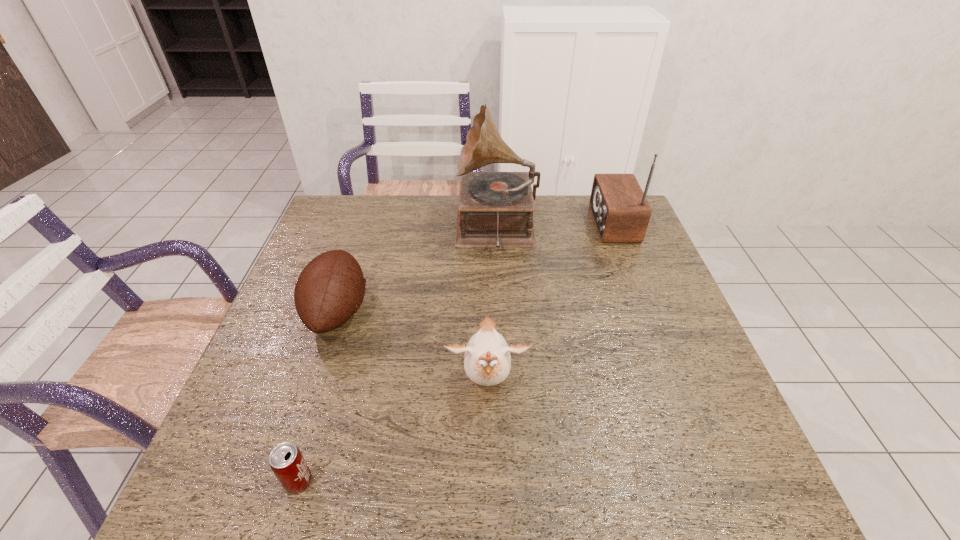
Image resolution: width=960 pixels, height=540 pixels. I want to click on free spot between the rightmost object and the tallest object, so click(554, 226).

At what (x,y) coordinates should I click in order to perform the action: click on free spot between the fourth farthest object and the radio receiver. Please return your answer as a coordinate pair (x, y). Looking at the image, I should click on (550, 303).

Where is `vacant space that's between the football and the beer can`? This screenshot has width=960, height=540. vacant space that's between the football and the beer can is located at coordinates (318, 396).

You are a GUI agent. You are given a task and a screenshot of the screen. Output one action in this format:
    pyautogui.click(x=<x>, y=<y>)
    Task: Click on the free point between the nearest object and the tallest object
    
    Given the screenshot: What is the action you would take?
    pyautogui.click(x=397, y=355)

Identify the location of free spot between the beer can and the record player. The image size is (960, 540). (397, 355).

Locate an element on the screen. Image resolution: width=960 pixels, height=540 pixels. free space between the rightmost object and the third farthest object is located at coordinates (475, 267).

Locate an element on the screen. This screenshot has height=540, width=960. empty space that is in between the radio receiver and the football is located at coordinates (475, 267).

I want to click on empty location between the bird and the nearest object, so click(393, 431).

At what (x,y) coordinates should I click in order to perform the action: click on object that is the closest one to the shortest object. Please return your answer as a coordinate pair (x, y). This screenshot has width=960, height=540. Looking at the image, I should click on (487, 361).

Where is `object that ranks as the third closest to the record player`? Image resolution: width=960 pixels, height=540 pixels. object that ranks as the third closest to the record player is located at coordinates tap(487, 361).